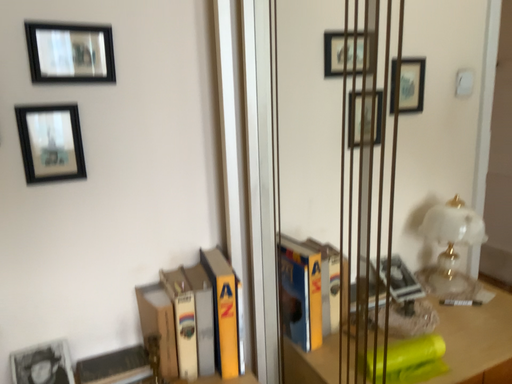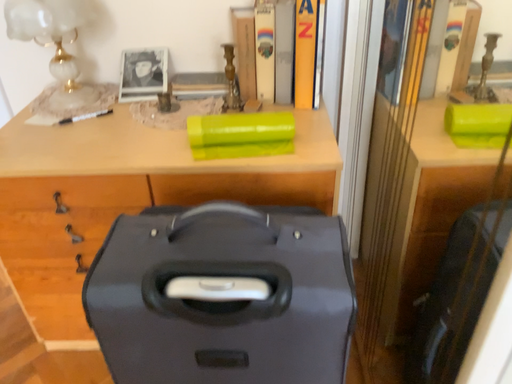
Question: How did the camera likely rotate when shooting the video?

Choices:
 (A) rotated upward
 (B) rotated downward

Answer: (B)